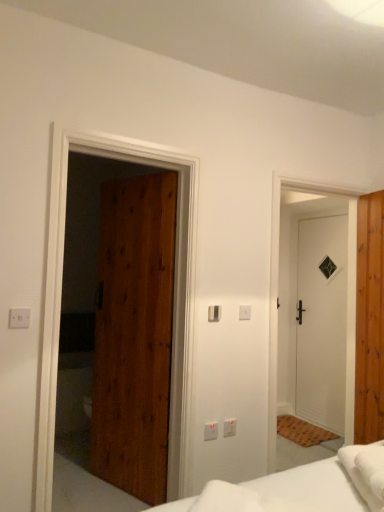
This screenshot has width=384, height=512. What do you see at coordinates (369, 320) in the screenshot?
I see `wooden door at right, the first door when ordered from right to left` at bounding box center [369, 320].

What do you see at coordinates (134, 335) in the screenshot? The width and height of the screenshot is (384, 512). I see `wooden door at left, which is the 1th door from left to right` at bounding box center [134, 335].

What do you see at coordinates (312, 486) in the screenshot? The width and height of the screenshot is (384, 512). I see `white soft bed at lower center` at bounding box center [312, 486].

What is the approximate width of white plastic light switch at center, the second light switch positioned from the bottom?

It is 0.88 inches.

The image size is (384, 512). Find the location of `white plastic electric outlet at left, the first electric outlet in the top-to-bottom sequence`. white plastic electric outlet at left, the first electric outlet in the top-to-bottom sequence is located at coordinates (19, 318).

From the image's perspective, who appears lower, white plastic electric outlet at left, which appears as the first electric outlet when viewed from the front, or white soft bedsheet at lower right?

white soft bedsheet at lower right.

Which object is positioned more to the left, white plastic electric outlet at left, which is the second electric outlet in right-to-left order, or white soft bedsheet at lower right?

white plastic electric outlet at left, which is the second electric outlet in right-to-left order.

Is white plastic electric outlet at left, the first electric outlet from the left, oriented away from white soft bedsheet at lower right?

No.

In the scene shown: Is white plastic electric outlet at left, the first electric outlet from the left, in contact with white soft bedsheet at lower right?

white plastic electric outlet at left, the first electric outlet from the left, and white soft bedsheet at lower right are clearly separated.

Between white soft bed at lower center and white soft bedsheet at lower right, which one appears on the right side from the viewer's perspective?

Positioned to the right is white soft bedsheet at lower right.

Which of these two, white soft bed at lower center or white soft bedsheet at lower right, is thinner?

With smaller width is white soft bed at lower center.

Is white soft bed at lower center with white soft bedsheet at lower right?

No, white soft bed at lower center is not touching white soft bedsheet at lower right.

In terms of size, does white soft bed at lower center appear bigger or smaller than white soft bedsheet at lower right?

In the image, white soft bed at lower center appears to be larger than white soft bedsheet at lower right.

Is white plastic electric outlet at center, which ranks as the first electric outlet in back-to-front order, taller or shorter than white plastic light switch at center, which ranks as the 3th light switch in left-to-right order?

white plastic electric outlet at center, which ranks as the first electric outlet in back-to-front order, is taller than white plastic light switch at center, which ranks as the 3th light switch in left-to-right order.

From the image's perspective, who appears lower, white plastic electric outlet at center, which ranks as the first electric outlet in back-to-front order, or white plastic light switch at center, which ranks as the 3th light switch in left-to-right order?

white plastic electric outlet at center, which ranks as the first electric outlet in back-to-front order.

Is point (228, 428) in front of point (246, 308)?

Yes, it is in front of point (246, 308).

Is white plastic electric outlet at center, the 2th electric outlet from the front, facing towards white plastic light switch at center, which is the 1th light switch from right to left?

No, white plastic electric outlet at center, the 2th electric outlet from the front, is not turned towards white plastic light switch at center, which is the 1th light switch from right to left.

Who is bigger, white matte door at right, the 2th door when ordered from left to right, or white soft bed at lower center?

With larger size is white matte door at right, the 2th door when ordered from left to right.

Is white matte door at right, the 2th door when ordered from left to right, not inside white soft bed at lower center?

Yes, white matte door at right, the 2th door when ordered from left to right, is outside of white soft bed at lower center.

In the scene shown: Is white matte door at right, positioned as the third door in front-to-back order, next to white soft bed at lower center?

white matte door at right, positioned as the third door in front-to-back order, and white soft bed at lower center are clearly separated.

Can you tell me how much white matte door at right, the 2th door when ordered from left to right, and white soft bed at lower center differ in facing direction?

138 degrees separate the facing orientations of white matte door at right, the 2th door when ordered from left to right, and white soft bed at lower center.

I want to click on the 1st light switch above the wooden door at right, acting as the second door starting from the back (from the image's perspective), so click(x=245, y=312).

Do you think wooden door at right, which appears as the third door when viewed from the left, is within white plastic light switch at center, the third light switch viewed from the front, or outside of it?

The correct answer is: outside.

Which is in front, wooden door at right, the first door when ordered from right to left, or white plastic light switch at center, the second light switch positioned from the bottom?

white plastic light switch at center, the second light switch positioned from the bottom, is closer to the camera.

Is white soft bedsheet at lower right aimed at white matte door at right, the 1th door when ordered from back to front?

Yes, white soft bedsheet at lower right is turned towards white matte door at right, the 1th door when ordered from back to front.

Considering the sizes of white soft bedsheet at lower right and white matte door at right, the 2th door when ordered from left to right, in the image, is white soft bedsheet at lower right bigger or smaller than white matte door at right, the 2th door when ordered from left to right,?

white soft bedsheet at lower right is smaller than white matte door at right, the 2th door when ordered from left to right.

Would you say white matte door at right, the 2th door when ordered from left to right, is part of white soft bedsheet at lower right's contents?

No, white soft bedsheet at lower right does not contain white matte door at right, the 2th door when ordered from left to right.

Considering the relative positions of white soft bedsheet at lower right and white matte door at right, the 2th door when ordered from left to right, in the image provided, is white soft bedsheet at lower right in front of white matte door at right, the 2th door when ordered from left to right,?

Yes, white soft bedsheet at lower right is closer to the camera.

From the image's perspective, is white plastic light switch at center, which ranks as the 3th light switch in left-to-right order, below satin silver switch at center, which is counted as the second light switch, starting from the right?

Yes, from the image's perspective, white plastic light switch at center, which ranks as the 3th light switch in left-to-right order, is below satin silver switch at center, which is counted as the second light switch, starting from the right.

From a real-world perspective, between white plastic light switch at center, which is the 1th light switch from right to left, and satin silver switch at center, which is counted as the second light switch, starting from the front, who is vertically lower?

satin silver switch at center, which is counted as the second light switch, starting from the front, from a real-world perspective.

Identify the location of light switch that appears above the white plastic light switch at center, placed as the second light switch when sorted from top to bottom (from the image's perspective). (214, 313).

Which object is positioned more to the left, white plastic light switch at center, placed as the second light switch when sorted from top to bottom, or satin silver switch at center, the 3th light switch from the bottom?

From the viewer's perspective, satin silver switch at center, the 3th light switch from the bottom, appears more on the left side.

The height and width of the screenshot is (512, 384). Identify the location of electric outlet that is the 2nd one when counting leftward from the white soft bedsheet at lower right. (19, 318).

The width and height of the screenshot is (384, 512). Find the location of `sheet that is on the right side of white soft bed at lower center`. sheet that is on the right side of white soft bed at lower center is located at coordinates (359, 476).

Which object lies further to the anchor point white matte door at right, the 2th door when ordered from left to right, metallic silver light switch at lower center, the third light switch from the top, or white soft bed at lower center?

Among the two, white soft bed at lower center is located further to white matte door at right, the 2th door when ordered from left to right.

Which object lies nearer to the anchor point metallic silver light switch at lower center, the third light switch from the top, satin silver switch at center, which is the second light switch in left-to-right order, or white soft bedsheet at lower right?

The object closer to metallic silver light switch at lower center, the third light switch from the top, is satin silver switch at center, which is the second light switch in left-to-right order.

When comparing their distances from white plastic electric outlet at center, which ranks as the first electric outlet in back-to-front order, does white soft bed at lower center or white plastic light switch at center, which ranks as the 3th light switch in left-to-right order, seem closer?

white plastic light switch at center, which ranks as the 3th light switch in left-to-right order.

When comparing their distances from white plastic electric outlet at left, which is the 2th electric outlet from back to front, does white plastic light switch at center, which ranks as the 3th light switch in left-to-right order, or white plastic electric outlet at center, arranged as the second electric outlet when viewed from the left, seem further?

Among the two, white plastic electric outlet at center, arranged as the second electric outlet when viewed from the left, is located further to white plastic electric outlet at left, which is the 2th electric outlet from back to front.

Based on their spatial positions, is white plastic electric outlet at center, which ranks as the first electric outlet in back-to-front order, or white soft bedsheet at lower right closer to white plastic light switch at center, which is the 1th light switch from right to left?

Based on the image, white plastic electric outlet at center, which ranks as the first electric outlet in back-to-front order, appears to be nearer to white plastic light switch at center, which is the 1th light switch from right to left.

Looking at the image, which one is located closer to white plastic electric outlet at left, which is the 2th electric outlet from back to front, white matte door at right, the 1th door when ordered from back to front, or white plastic light switch at center, which ranks as the 3th light switch in left-to-right order?

white plastic light switch at center, which ranks as the 3th light switch in left-to-right order, is closer to white plastic electric outlet at left, which is the 2th electric outlet from back to front.

Which object lies nearer to the anchor point wooden door at left, which ranks as the 3th door in right-to-left order, white soft bed at lower center or white plastic light switch at center, the third light switch viewed from the front?

white plastic light switch at center, the third light switch viewed from the front.

Considering their positions, is white plastic electric outlet at center, which ranks as the first electric outlet in back-to-front order, positioned closer to white plastic light switch at center, which ranks as the 3th light switch in left-to-right order, than wooden door at left, which is the 1th door from left to right?

white plastic electric outlet at center, which ranks as the first electric outlet in back-to-front order, is closer to white plastic light switch at center, which ranks as the 3th light switch in left-to-right order.

Identify the location of door between white soft bed at lower center and metallic silver light switch at lower center, the first light switch when ordered from front to back, from front to back. pyautogui.click(x=134, y=335).

The width and height of the screenshot is (384, 512). Find the location of `door between wooden door at left, which ranks as the first door in front-to-back order, and wooden door at right, which is the second door in front-to-back order, in the horizontal direction`. door between wooden door at left, which ranks as the first door in front-to-back order, and wooden door at right, which is the second door in front-to-back order, in the horizontal direction is located at coordinates (322, 322).

The image size is (384, 512). Identify the location of door located between metallic silver light switch at lower center, the third light switch from the top, and wooden door at right, which appears as the third door when viewed from the left, in the left-right direction. (322, 322).

Identify the location of electric outlet between wooden door at left, which is the 1th door from left to right, and white matte door at right, the 2th door when ordered from left to right. (230, 426).